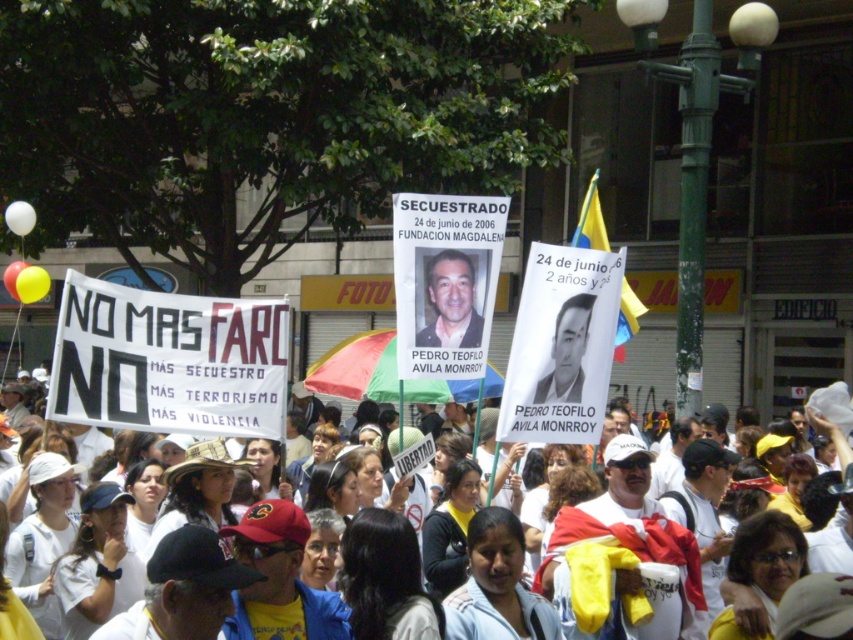
Question: Can you confirm if matte black photo at center is positioned to the right of black matte poster at center?

Choices:
 (A) yes
 (B) no

Answer: (B)

Question: Which point appears closest to the camera in this image?

Choices:
 (A) (848, 449)
 (B) (453, 324)

Answer: (B)

Question: Which point is farther from the camera taking this photo?

Choices:
 (A) (433, 278)
 (B) (566, 381)

Answer: (A)

Question: Based on their relative distances, which object is nearer to the white paper sign at center?

Choices:
 (A) black matte poster at center
 (B) matte black photo at center

Answer: (A)

Question: Can you confirm if matte black photo at center is wider than white paper sign at center?

Choices:
 (A) yes
 (B) no

Answer: (B)

Question: Can you confirm if matte black photo at center is bigger than black matte poster at center?

Choices:
 (A) yes
 (B) no

Answer: (A)